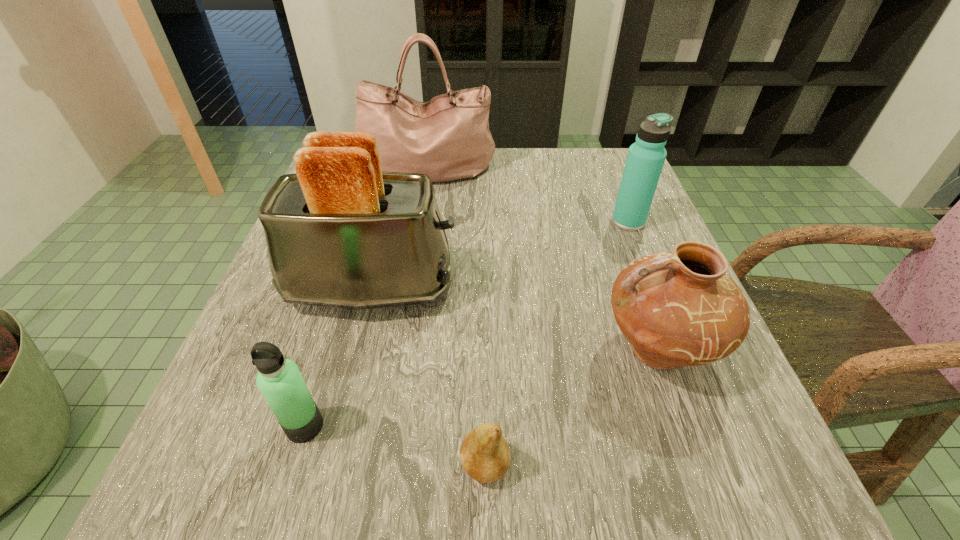
Select which object appears as the fourth closest to the pottery. Please provide its 2D coordinates. Your answer should be formatted as a tuple, i.e. [(x, y)], where the tuple contains the x and y coordinates of a point satisfying the conditions above.

[(447, 138)]

I want to click on free space that satisfies the following two spatial constraints: 1. on the side of the pottery with the handle; 2. on the side of the toaster with the control lever, so click(636, 288).

The width and height of the screenshot is (960, 540). I want to click on free space in the image that satisfies the following two spatial constraints: 1. on the back side of the fifth nearest object; 2. on the right side of the left thermos bottle, so click(367, 221).

Identify the location of vacant space that satisfies the following two spatial constraints: 1. on the side of the pottery with the handle; 2. at the front of the farthest object with handles. This screenshot has height=540, width=960. (594, 170).

At what (x,y) coordinates should I click in order to perform the action: click on vacant space that satisfies the following two spatial constraints: 1. on the side of the pottery with the handle; 2. on the left side of the fifth nearest object. Please return your answer as a coordinate pair (x, y). Image resolution: width=960 pixels, height=540 pixels. Looking at the image, I should click on (612, 221).